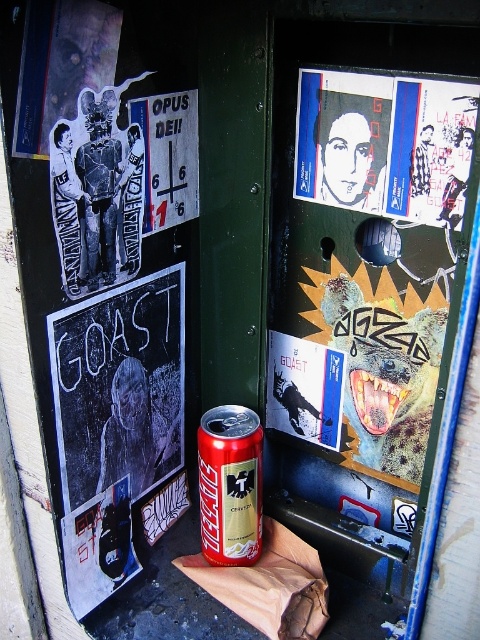
You are trying to hang a new poster on the door. The current door has a black chalkboard at left and a white paper poster at upper right. Which object takes up more space on the door?

The black chalkboard at left has a larger size compared to the white paper poster at upper right, so it takes up more space on the door.

You are trying to hang a new poster on the door. The existing items are the black chalkboard at left and the matte paper poster at center. Which object is wider so that you can choose a spot next to it?

The black chalkboard at left is wider than the matte paper poster at center, so you can choose a spot next to the black chalkboard at left.